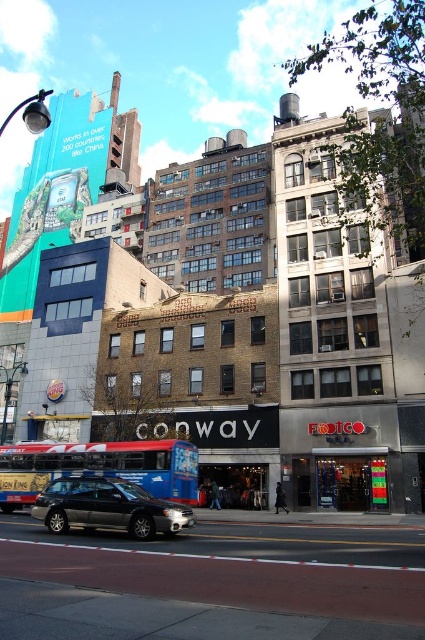
Measure the distance between blue metallic bus at center and metallic gray sedan at center.

5.94 meters

Can you confirm if blue metallic bus at center is wider than metallic gray sedan at center?

Indeed, blue metallic bus at center has a greater width compared to metallic gray sedan at center.

At what (x,y) coordinates should I click in order to perform the action: click on blue metallic bus at center. Please return your answer as a coordinate pair (x, y). Looking at the image, I should click on (99, 467).